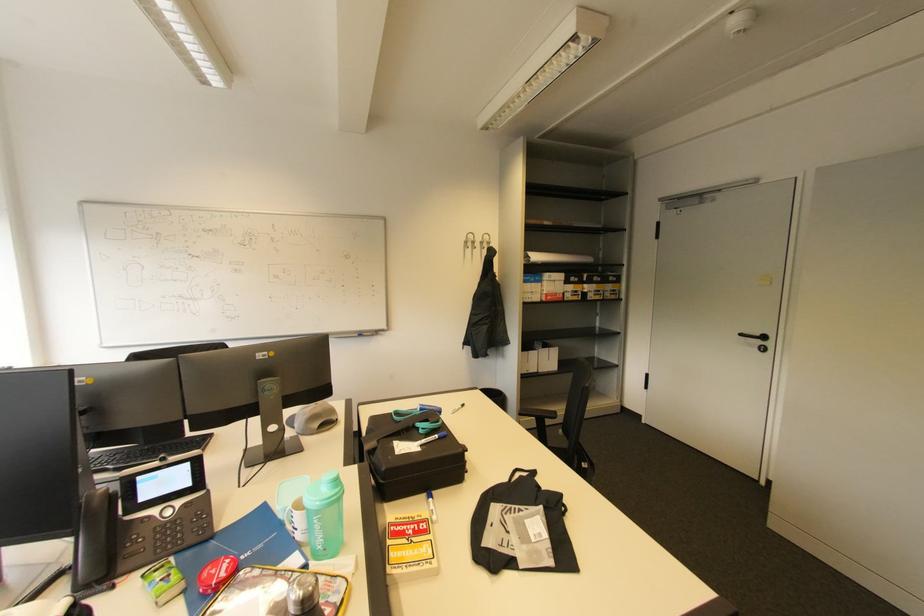
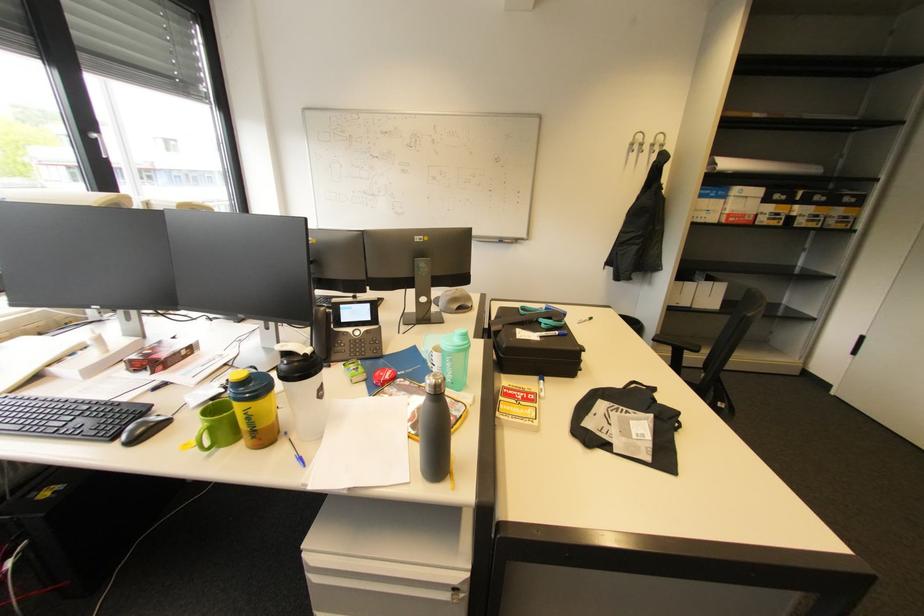
Question: The camera is either moving clockwise (left) or counter-clockwise (right) around the object. The first image is from the beginning of the video and the second image is from the end. Is the camera moving left or right when shooting the video?

Choices:
 (A) Left
 (B) Right

Answer: (B)